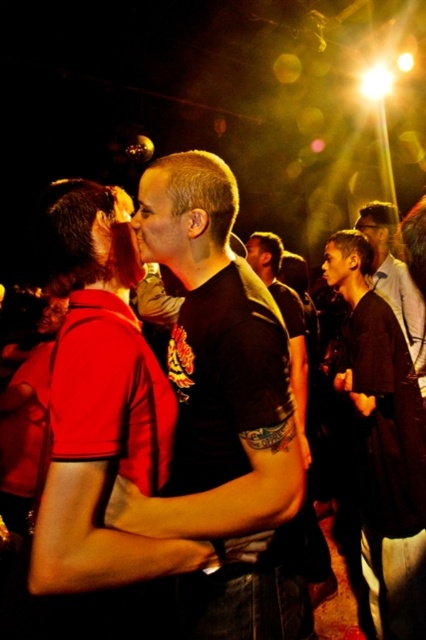
Question: Can you confirm if black matte t-shirt at center is positioned to the right of black matte shirt at center?

Choices:
 (A) no
 (B) yes

Answer: (A)

Question: Does black matte t-shirt at center have a lesser width compared to black matte shirt at center?

Choices:
 (A) yes
 (B) no

Answer: (B)

Question: Among these points, which one is farthest from the camera?

Choices:
 (A) (293, 476)
 (B) (388, 566)

Answer: (B)

Question: Which point is closer to the camera?

Choices:
 (A) black matte shirt at center
 (B) black matte t-shirt at center

Answer: (B)

Question: Where is black matte t-shirt at center located in relation to black matte shirt at center in the image?

Choices:
 (A) above
 (B) below

Answer: (A)